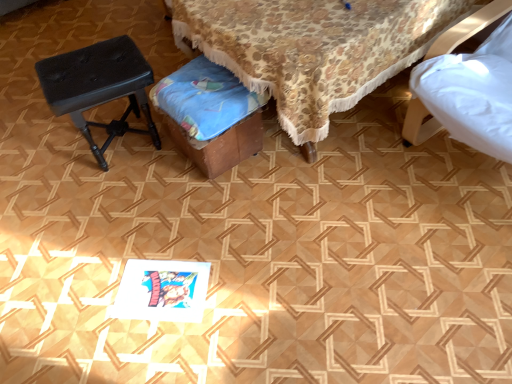
The height and width of the screenshot is (384, 512). What are the coordinates of `free space to the left of wooden music stool at center` in the screenshot? It's located at (148, 184).